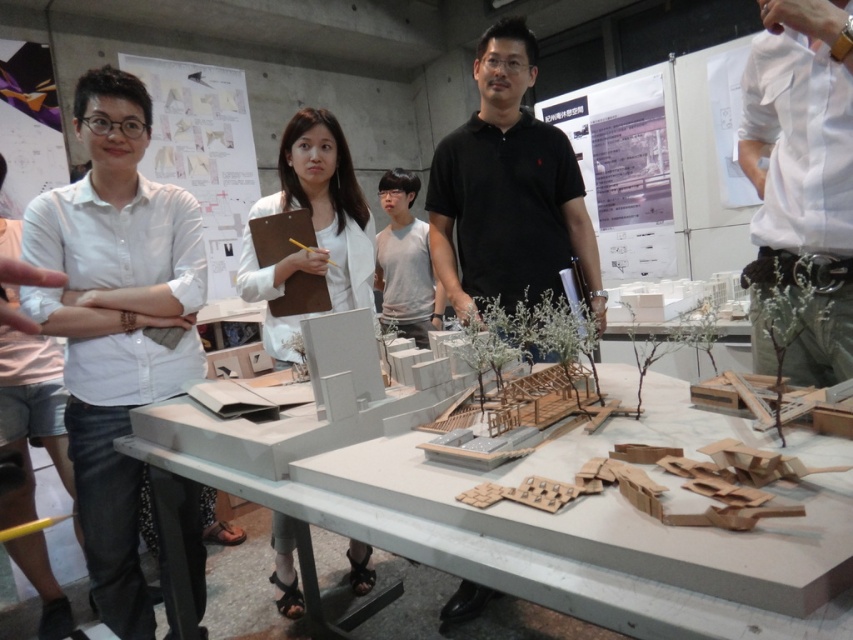
Is the position of white matte table at center less distant than that of black polo shirt at center?

Yes, it is.

Is point (631, 534) behind point (444, 280)?

No.

Where is `white matte table at center`? This screenshot has width=853, height=640. white matte table at center is located at coordinates (577, 531).

Is point (828, 205) in front of point (518, 243)?

Yes, it is.

You are a GUI agent. You are given a task and a screenshot of the screen. Output one action in this format:
    pyautogui.click(x=<x>, y=<y>)
    Task: Click on the white cotton shirt at upper right
    This screenshot has height=640, width=853.
    Given the screenshot: What is the action you would take?
    pyautogui.click(x=804, y=170)

I want to click on white cotton shirt at upper right, so click(x=804, y=170).

Does white shirt at left have a larger size compared to white matte model at center?

No, white shirt at left is not bigger than white matte model at center.

Does white shirt at left have a lesser width compared to white matte model at center?

Yes.

The height and width of the screenshot is (640, 853). Find the location of `white shirt at left`. white shirt at left is located at coordinates (115, 321).